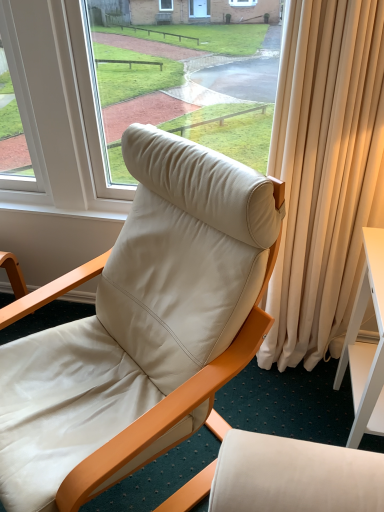
Question: From a real-world perspective, is matte white leather chair at center physically below white glossy desk at right?

Choices:
 (A) no
 (B) yes

Answer: (A)

Question: Is matte white leather chair at center looking in the opposite direction of white glossy desk at right?

Choices:
 (A) yes
 (B) no

Answer: (B)

Question: Considering the relative sizes of matte white leather chair at center and white glossy desk at right in the image provided, is matte white leather chair at center thinner than white glossy desk at right?

Choices:
 (A) yes
 (B) no

Answer: (B)

Question: Considering the relative sizes of matte white leather chair at center and white glossy desk at right in the image provided, is matte white leather chair at center taller than white glossy desk at right?

Choices:
 (A) yes
 (B) no

Answer: (A)

Question: Is matte white leather chair at center located outside white glossy desk at right?

Choices:
 (A) no
 (B) yes

Answer: (B)

Question: From the image's perspective, would you say matte white leather chair at center is positioned over white glossy desk at right?

Choices:
 (A) no
 (B) yes

Answer: (B)

Question: From the image's perspective, is white glossy desk at right on matte white leather chair at center?

Choices:
 (A) no
 (B) yes

Answer: (A)

Question: Is white glossy desk at right far away from matte white leather chair at center?

Choices:
 (A) no
 (B) yes

Answer: (A)

Question: From a real-world perspective, is white glossy desk at right over matte white leather chair at center?

Choices:
 (A) no
 (B) yes

Answer: (A)

Question: From the image's perspective, is white glossy desk at right under matte white leather chair at center?

Choices:
 (A) yes
 (B) no

Answer: (A)

Question: Considering the relative positions of white glossy desk at right and matte white leather chair at center in the image provided, is white glossy desk at right behind matte white leather chair at center?

Choices:
 (A) yes
 (B) no

Answer: (A)

Question: Is white glossy desk at right smaller than matte white leather chair at center?

Choices:
 (A) yes
 (B) no

Answer: (A)

Question: Visually, is white glossy desk at right positioned to the left or to the right of matte white leather chair at center?

Choices:
 (A) right
 (B) left

Answer: (A)